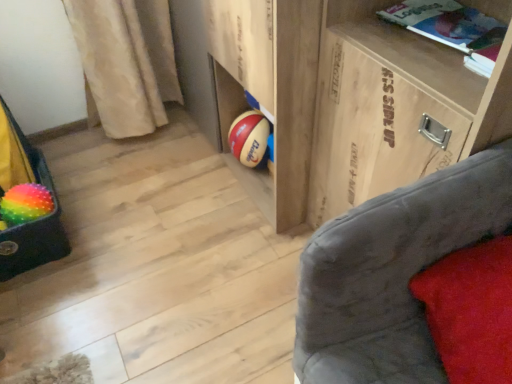
Question: Does rainbow rubber beach ball at lower left have a greater width compared to red velvet pillow at lower right?

Choices:
 (A) no
 (B) yes

Answer: (A)

Question: From the image's perspective, is rainbow rubber beach ball at lower left beneath red velvet pillow at lower right?

Choices:
 (A) yes
 (B) no

Answer: (B)

Question: Would you consider rainbow rubber beach ball at lower left to be distant from red velvet pillow at lower right?

Choices:
 (A) yes
 (B) no

Answer: (A)

Question: Are rainbow rubber beach ball at lower left and red velvet pillow at lower right making contact?

Choices:
 (A) yes
 (B) no

Answer: (B)

Question: Considering the relative positions of rainbow rubber beach ball at lower left and red velvet pillow at lower right in the image provided, is rainbow rubber beach ball at lower left to the right of red velvet pillow at lower right from the viewer's perspective?

Choices:
 (A) yes
 (B) no

Answer: (B)

Question: Is red velvet pillow at lower right wider or thinner than rainbow fuzzy bean bag chair at left?

Choices:
 (A) wide
 (B) thin

Answer: (A)

Question: Is red velvet pillow at lower right in front of or behind rainbow fuzzy bean bag chair at left in the image?

Choices:
 (A) front
 (B) behind

Answer: (A)

Question: Visually, is red velvet pillow at lower right positioned to the left or to the right of rainbow fuzzy bean bag chair at left?

Choices:
 (A) left
 (B) right

Answer: (B)

Question: Is red velvet pillow at lower right spatially inside rainbow fuzzy bean bag chair at left, or outside of it?

Choices:
 (A) inside
 (B) outside

Answer: (B)

Question: Considering their positions, is white paper book at upper right located in front of or behind red velvet pillow at lower right?

Choices:
 (A) front
 (B) behind

Answer: (B)

Question: Considering the positions of white paper book at upper right and red velvet pillow at lower right in the image, is white paper book at upper right wider or thinner than red velvet pillow at lower right?

Choices:
 (A) wide
 (B) thin

Answer: (B)

Question: Is white paper book at upper right spatially inside red velvet pillow at lower right, or outside of it?

Choices:
 (A) inside
 (B) outside

Answer: (B)

Question: From the image's perspective, is white paper book at upper right located above or below red velvet pillow at lower right?

Choices:
 (A) below
 (B) above

Answer: (B)

Question: Considering the positions of point (37, 216) and point (439, 28), is point (37, 216) closer or farther from the camera than point (439, 28)?

Choices:
 (A) closer
 (B) farther

Answer: (B)

Question: Visually, is rainbow rubber beach ball at lower left positioned to the left or to the right of white paper book at upper right?

Choices:
 (A) left
 (B) right

Answer: (A)